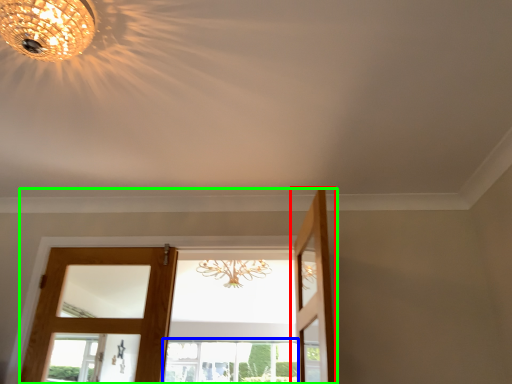
Question: Based on their relative distances, which object is farther from door (highlighted by a red box)? Choose from window (highlighted by a blue box) and door (highlighted by a green box).

Choices:
 (A) window
 (B) door

Answer: (A)